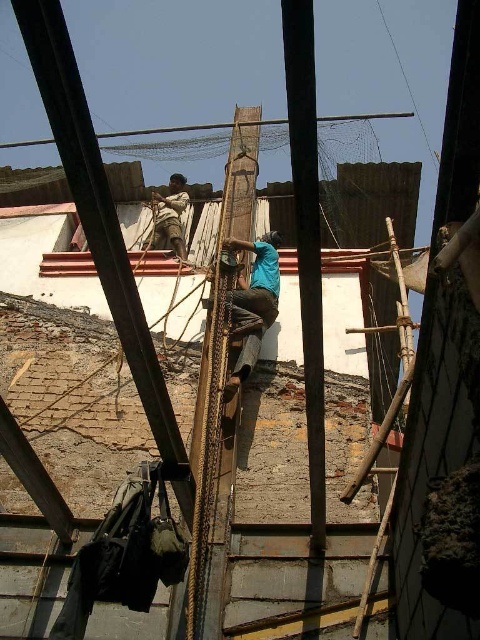
Who is lower down, blue fabric construction worker at center or bamboo ladder at center?

bamboo ladder at center

Measure the distance between point (254,336) and camera.

The distance of point (254,336) from camera is 55.83 meters.

Find the location of a particular element. The image size is (480, 640). blue fabric construction worker at center is located at coordinates (253, 300).

Measure the distance from smooth wood pole at center to blue fabric construction worker at center.

A distance of 6.86 meters exists between smooth wood pole at center and blue fabric construction worker at center.

Consider the image. Is the position of smooth wood pole at center more distant than that of blue fabric construction worker at center?

No, smooth wood pole at center is closer to the viewer.

Between point (314, 227) and point (278, 241), which one is positioned behind?

The point (278, 241) is behind.

Where is `smooth wood pole at center`? This screenshot has height=640, width=480. smooth wood pole at center is located at coordinates (307, 240).

Which is behind, point (285, 20) or point (371, 577)?

The point (371, 577) is more distant.

Based on the photo, is smooth wood pole at center wider than bamboo ladder at center?

No.

Find the location of a particular element. smooth wood pole at center is located at coordinates (307, 240).